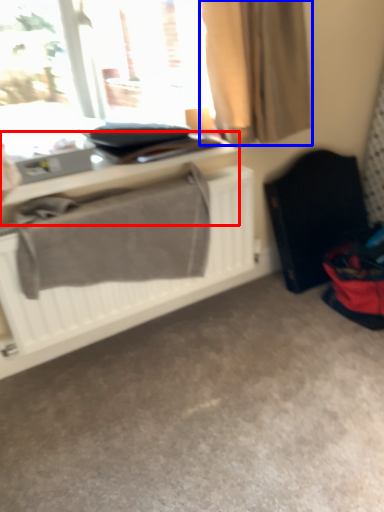
Question: Among these objects, which one is nearest to the camera, table (highlighted by a red box) or curtain (highlighted by a blue box)?

Choices:
 (A) table
 (B) curtain

Answer: (B)